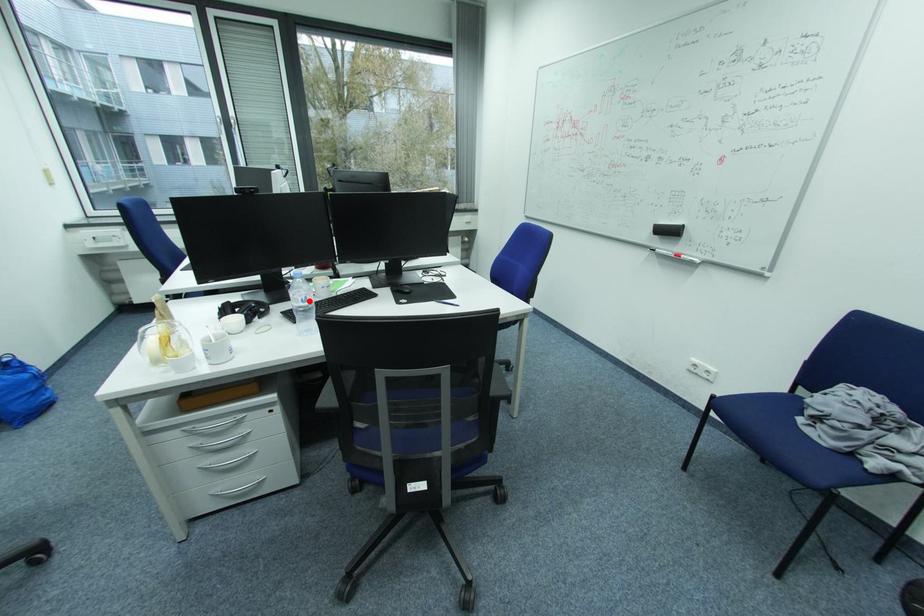
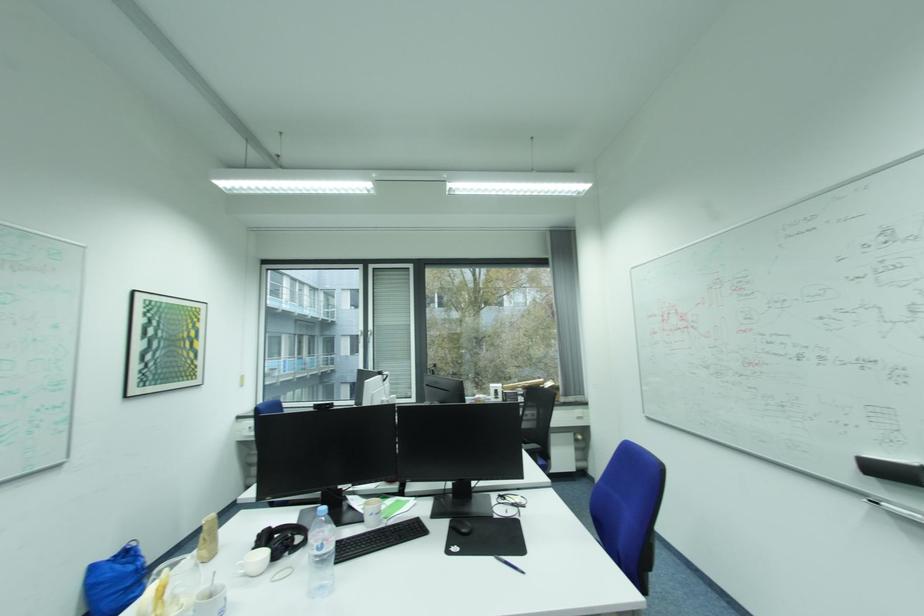
Question: I am providing you with two images of the same scene from different viewpoints. A red point is shown in image1. For the corresponding object point in image2, is it positioned nearer or farther from the camera?

Choices:
 (A) Nearer
 (B) Farther

Answer: (B)